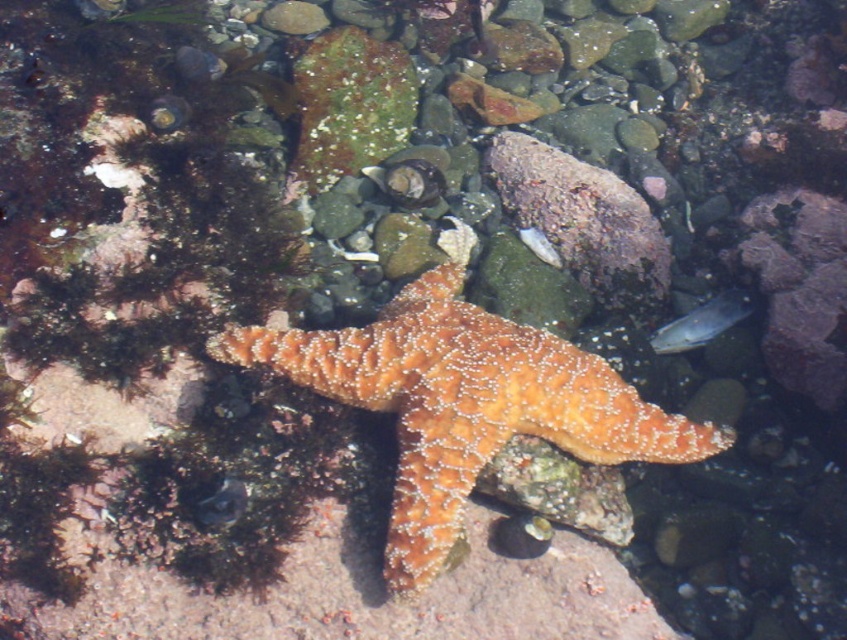
Question: Is orange textured starfish at center bigger than translucent plastic fish at center?

Choices:
 (A) yes
 (B) no

Answer: (A)

Question: Which object appears farthest from the camera in this image?

Choices:
 (A) translucent plastic fish at center
 (B) orange textured starfish at center

Answer: (A)

Question: Can you confirm if orange textured starfish at center is positioned below translucent plastic fish at center?

Choices:
 (A) no
 (B) yes

Answer: (B)

Question: Does orange textured starfish at center have a smaller size compared to translucent plastic fish at center?

Choices:
 (A) yes
 (B) no

Answer: (B)

Question: Which point is closer to the camera?

Choices:
 (A) (674, 344)
 (B) (237, 333)

Answer: (B)